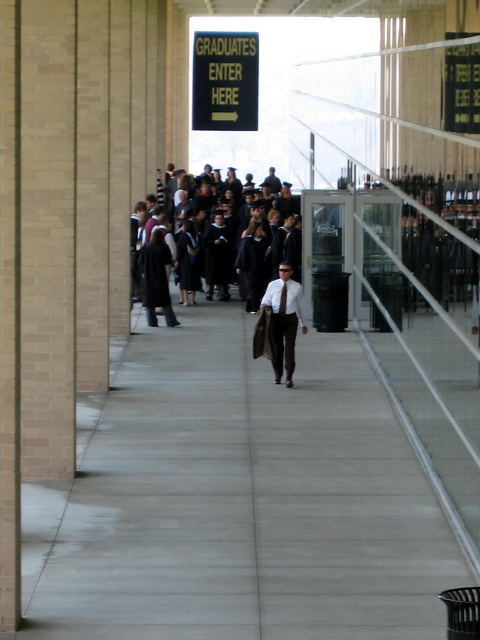
Can you confirm if brown leather pants at center is bigger than black matte graduation gowns at center?

Indeed, brown leather pants at center has a larger size compared to black matte graduation gowns at center.

Who is higher up, brown leather pants at center or black matte graduation gowns at center?

Positioned higher is black matte graduation gowns at center.

Which is in front, point (277, 342) or point (227, 280)?

Point (277, 342) is in front.

The image size is (480, 640). In order to click on brown leather pants at center in this screenshot , I will do `click(285, 317)`.

Is gold/black sign at upper center to the right of black matte graduation gowns at center from the viewer's perspective?

Correct, you'll find gold/black sign at upper center to the right of black matte graduation gowns at center.

Between gold/black sign at upper center and black matte graduation gowns at center, which one appears on the left side from the viewer's perspective?

From the viewer's perspective, black matte graduation gowns at center appears more on the left side.

Which is behind, point (192, 68) or point (222, 228)?

The point (192, 68) is more distant.

Where is `gold/black sign at upper center`? gold/black sign at upper center is located at coordinates (225, 81).

Can you confirm if gold/black sign at upper center is smaller than brown leather pants at center?

Actually, gold/black sign at upper center might be larger than brown leather pants at center.

How far apart are gold/black sign at upper center and brown leather pants at center?

gold/black sign at upper center and brown leather pants at center are 20.67 meters apart from each other.

Is point (257, 74) farther from camera compared to point (300, 317)?

That is True.

The height and width of the screenshot is (640, 480). What are the coordinates of `gold/black sign at upper center` in the screenshot? It's located at (225, 81).